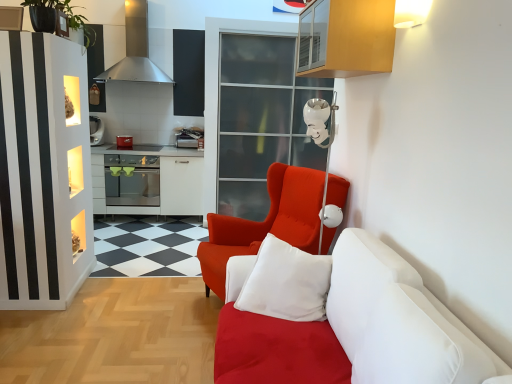
Question: Should I look upward or downward to see metallic silver toaster at center, marked as the second appliance in a left-to-right arrangement?

Choices:
 (A) up
 (B) down

Answer: (A)

Question: Is transparent glass door at upper center thinner than satin silver oven at center?

Choices:
 (A) no
 (B) yes

Answer: (A)

Question: From a real-world perspective, is transparent glass door at upper center located beneath satin silver oven at center?

Choices:
 (A) no
 (B) yes

Answer: (A)

Question: Does transparent glass door at upper center appear on the left side of satin silver oven at center?

Choices:
 (A) no
 (B) yes

Answer: (A)

Question: Is transparent glass door at upper center at the right side of satin silver oven at center?

Choices:
 (A) yes
 (B) no

Answer: (A)

Question: Is transparent glass door at upper center smaller than satin silver oven at center?

Choices:
 (A) no
 (B) yes

Answer: (A)

Question: Is transparent glass door at upper center shorter than satin silver oven at center?

Choices:
 (A) yes
 (B) no

Answer: (B)

Question: From the image's perspective, is stainless steel exhaust hood at upper left over satin red armchair at center?

Choices:
 (A) no
 (B) yes

Answer: (B)

Question: Is the surface of stainless steel exhaust hood at upper left in direct contact with satin red armchair at center?

Choices:
 (A) no
 (B) yes

Answer: (A)

Question: Does stainless steel exhaust hood at upper left turn towards satin red armchair at center?

Choices:
 (A) no
 (B) yes

Answer: (A)

Question: Does stainless steel exhaust hood at upper left appear on the left side of satin red armchair at center?

Choices:
 (A) yes
 (B) no

Answer: (A)

Question: From a real-world perspective, is stainless steel exhaust hood at upper left under satin red armchair at center?

Choices:
 (A) yes
 (B) no

Answer: (B)

Question: Would you say stainless steel exhaust hood at upper left is a long distance from satin red armchair at center?

Choices:
 (A) no
 (B) yes

Answer: (B)

Question: Can you confirm if white soft cushion at center is positioned to the left of stainless steel exhaust hood at upper left?

Choices:
 (A) no
 (B) yes

Answer: (A)